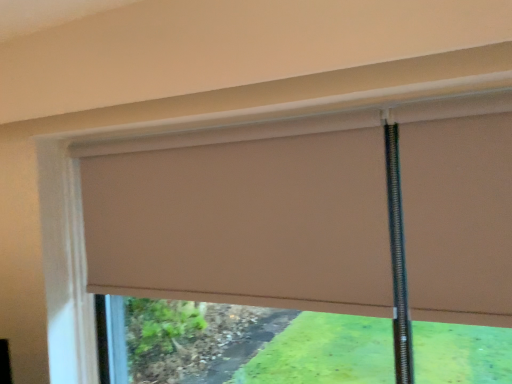
Measure the distance between beige fabric window blind at center and camera.

beige fabric window blind at center and camera are 1.02 meters apart.

Image resolution: width=512 pixels, height=384 pixels. What do you see at coordinates (244, 215) in the screenshot?
I see `beige fabric window blind at center` at bounding box center [244, 215].

At what (x,y) coordinates should I click in order to perform the action: click on beige fabric window blind at center. Please return your answer as a coordinate pair (x, y). Image resolution: width=512 pixels, height=384 pixels. Looking at the image, I should click on (244, 215).

This screenshot has width=512, height=384. Identify the location of beige fabric window blind at center. (244, 215).